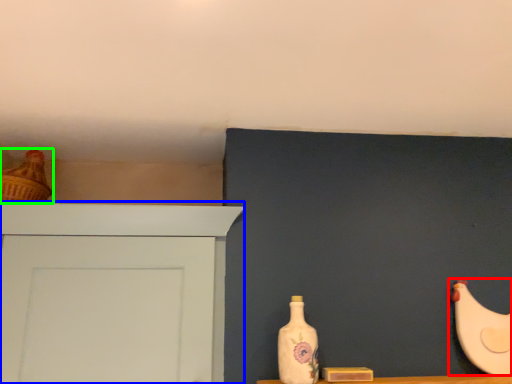
Question: Which object is positioned farthest from chicken (highlighted by a red box)? Select from door (highlighted by a blue box) and chicken (highlighted by a green box).

Choices:
 (A) door
 (B) chicken

Answer: (B)